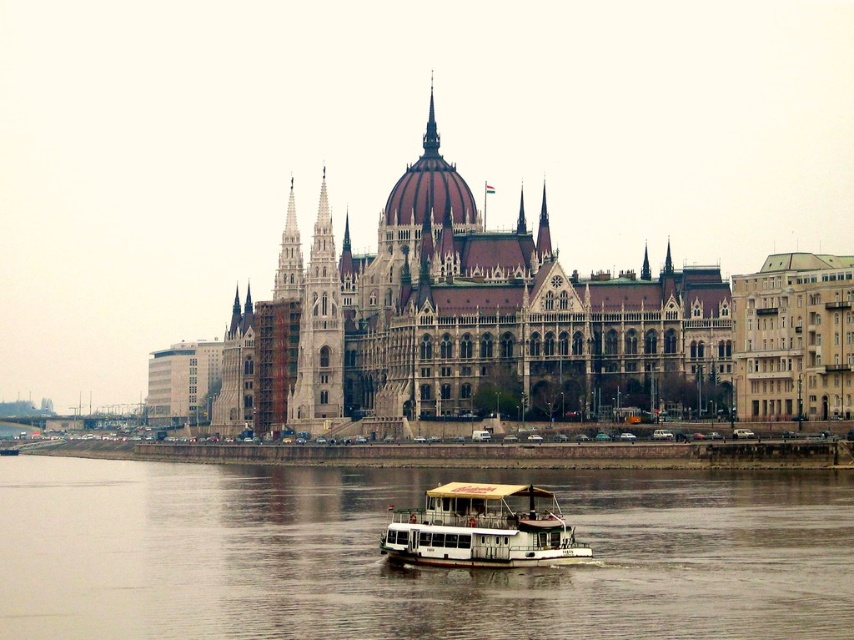
Who is positioned more to the right, brown water at center or white stone tower at center?

From the viewer's perspective, brown water at center appears more on the right side.

Is brown water at center closer to camera compared to white stone tower at center?

Yes, brown water at center is in front of white stone tower at center.

Does point (330, 483) come behind point (299, 260)?

No, it is in front of (299, 260).

The width and height of the screenshot is (854, 640). I want to click on brown water at center, so click(410, 570).

Can you confirm if white plastic boat at center is bigger than white stone tower at center?

No.

Who is more forward, [500,540] or [314,385]?

Point [500,540] is in front.

This screenshot has height=640, width=854. I want to click on white plastic boat at center, so click(481, 529).

Is brown water at center wider than brown stone building at center?

Correct, the width of brown water at center exceeds that of brown stone building at center.

Does brown water at center appear under brown stone building at center?

Yes.

The image size is (854, 640). What do you see at coordinates (410, 570) in the screenshot?
I see `brown water at center` at bounding box center [410, 570].

Where is `brown water at center`? This screenshot has width=854, height=640. brown water at center is located at coordinates (410, 570).